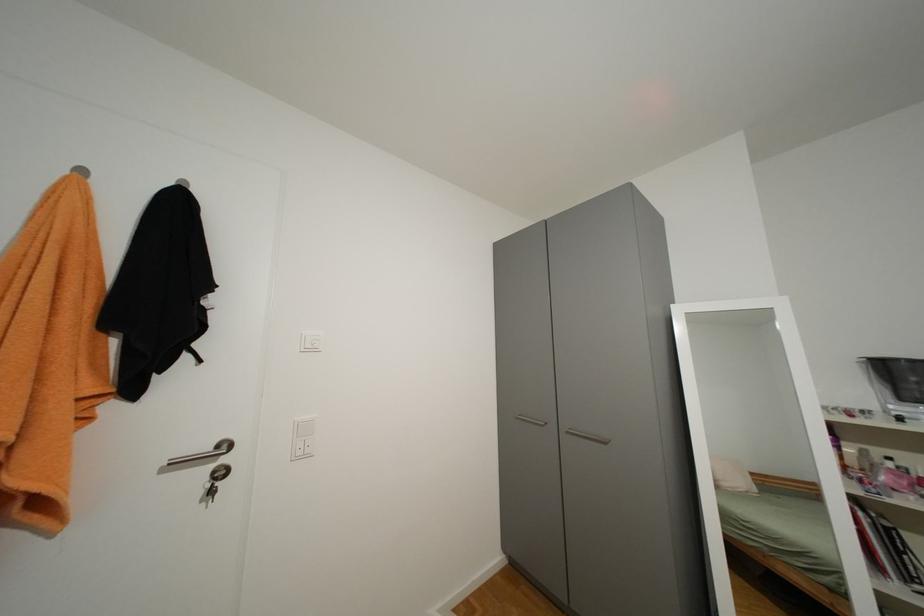
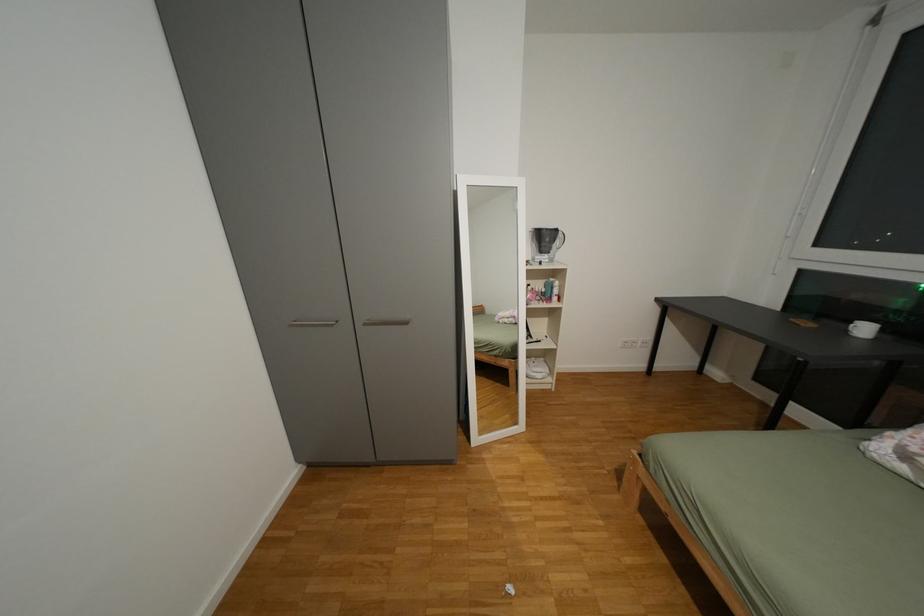
Consider the image. How did the camera likely rotate?

The camera's rotation is toward right-down.